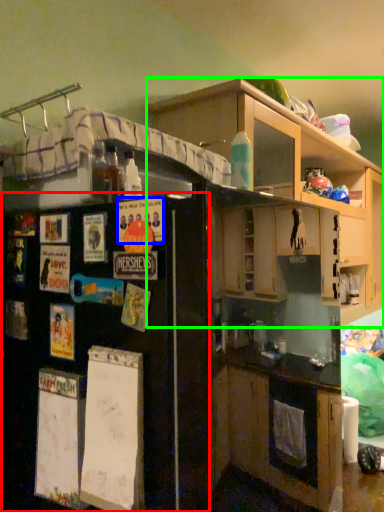
Question: Which object is positioned farthest from refrigerator (highlighted by a red box)? Select from poster (highlighted by a blue box) and cabinetry (highlighted by a green box).

Choices:
 (A) poster
 (B) cabinetry

Answer: (B)